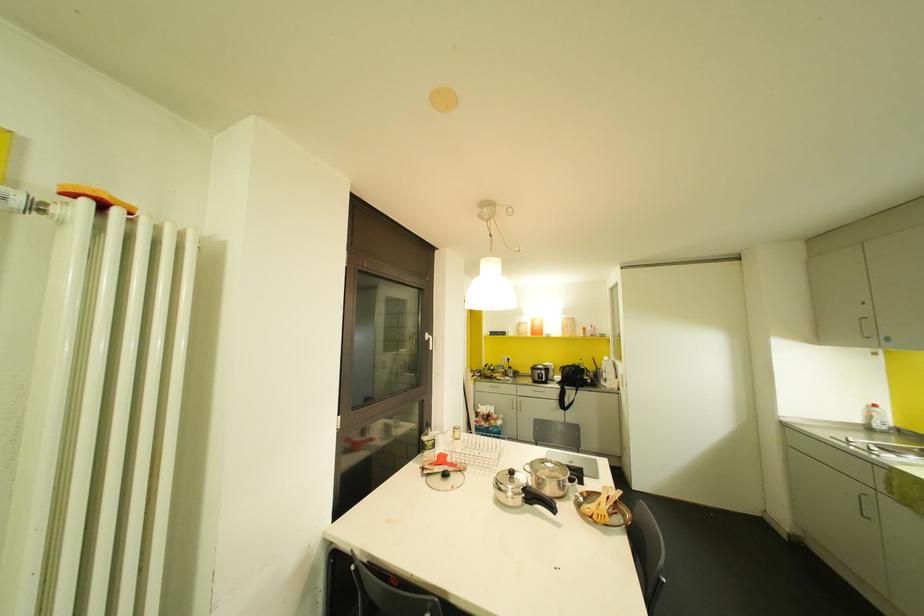
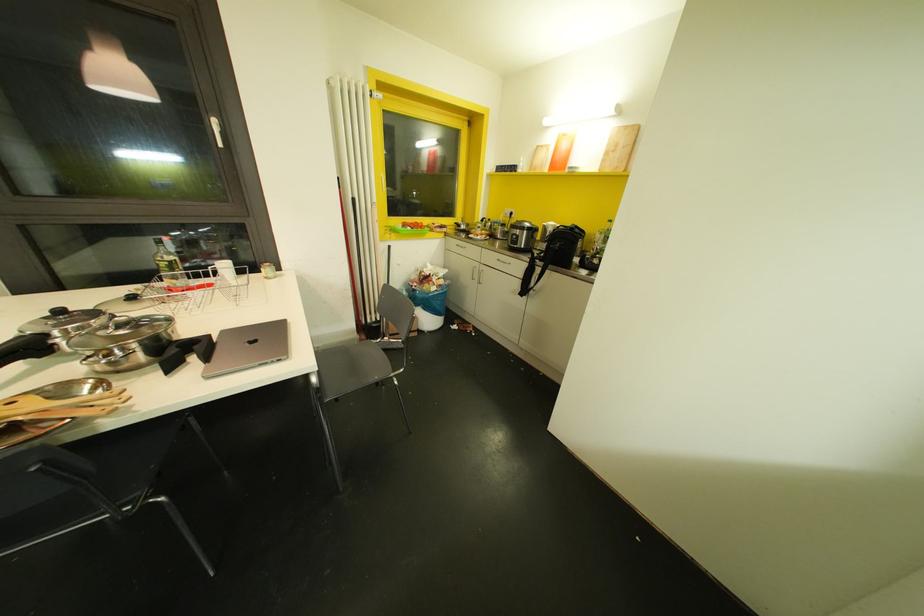
In the second image, find the point that corresponds to point 565,334 in the first image.

(606, 169)